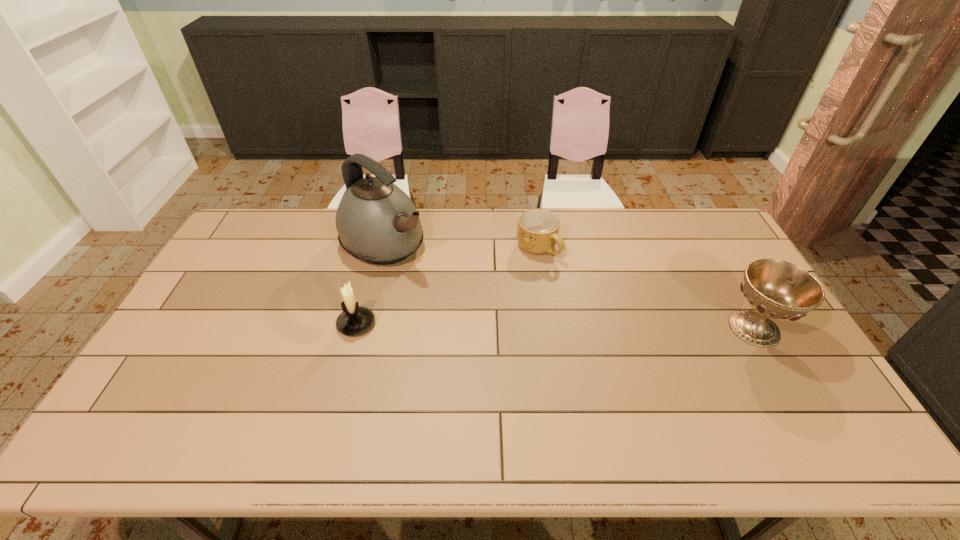
Locate an element on the screen. vacant point located between the shortest object and the kettle is located at coordinates (462, 246).

Find the location of a particular element. the closest object relative to the second object from right to left is located at coordinates (377, 222).

The image size is (960, 540). What are the coordinates of `object that is the third closest one to the rightmost object` in the screenshot? It's located at 354,320.

Image resolution: width=960 pixels, height=540 pixels. Identify the location of vacant point that satisfies the following two spatial constraints: 1. on the back side of the candle holder; 2. on the left side of the tallest object. (377, 244).